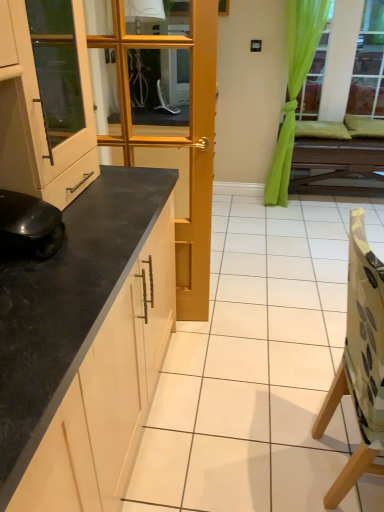
The height and width of the screenshot is (512, 384). Identify the location of wooden table at center. (337, 165).

In order to face black granite countertop at left, should I rotate leftwards or rightwards?

You should look left and rotate roughly 14.981 degrees.

This screenshot has height=512, width=384. What are the coordinates of `black matte robot vacuum cleaner at lower left` in the screenshot? It's located at (29, 225).

What do you see at coordinates (29, 225) in the screenshot? I see `black matte robot vacuum cleaner at lower left` at bounding box center [29, 225].

The width and height of the screenshot is (384, 512). What do you see at coordinates (40, 117) in the screenshot?
I see `matte white cabinet at left` at bounding box center [40, 117].

Locate an element on the screen. green fabric curtain at upper right is located at coordinates (294, 88).

Find the location of a particular element. The image size is (384, 512). wooden table at center is located at coordinates 337,165.

From the image's perspective, which is below, camouflage fabric chair at right or wooden table at center?

camouflage fabric chair at right is shown below in the image.

Considering the positions of points (379, 469) and (319, 178), is point (379, 469) farther from camera compared to point (319, 178)?

No.

Is camouflage fabric chair at right facing towards wooden table at center?

No, camouflage fabric chair at right is not turned towards wooden table at center.

Would you say camouflage fabric chair at right is inside or outside wooden table at center?

camouflage fabric chair at right is spatially situated outside wooden table at center.

How much distance is there between wooden table at center and camouflage fabric chair at right?

A distance of 2.52 meters exists between wooden table at center and camouflage fabric chair at right.

From the image's perspective, which one is positioned lower, wooden table at center or camouflage fabric chair at right?

camouflage fabric chair at right, from the image's perspective.

This screenshot has width=384, height=512. Identify the location of table above the camouflage fabric chair at right (from the image's perspective). (337, 165).

Does wooden table at center lie in front of camouflage fabric chair at right?

No, the depth of wooden table at center is greater than that of camouflage fabric chair at right.

At what (x,y) coordinates should I click in order to perform the action: click on door in front of the green fabric curtain at upper right. Please return your answer as a coordinate pair (x, y). Looking at the image, I should click on (164, 112).

Choose the correct answer: Is wooden door at center inside green fabric curtain at upper right or outside it?

wooden door at center cannot be found inside green fabric curtain at upper right.

Considering the points (175, 8) and (317, 29), which point is in front, point (175, 8) or point (317, 29)?

Point (175, 8)

From a real-world perspective, between black granite countertop at left and camouflage fabric chair at right, who is vertically lower?

black granite countertop at left is physically lower.

Is black granite countertop at left surrounding camouflage fabric chair at right?

No, black granite countertop at left does not contain camouflage fabric chair at right.

Is camouflage fabric chair at right at the back of black granite countertop at left?

No.

From the image's perspective, which is below, black granite countertop at left or camouflage fabric chair at right?

camouflage fabric chair at right is shown below in the image.

Which is in front, point (306, 40) or point (367, 168)?

The point (306, 40) is closer.

From the image's perspective, is green fabric curtain at upper right above wooden table at center?

Yes, from the image's perspective, green fabric curtain at upper right is on top of wooden table at center.

From their relative heights in the image, would you say green fabric curtain at upper right is taller or shorter than wooden table at center?

green fabric curtain at upper right is taller than wooden table at center.

The height and width of the screenshot is (512, 384). Find the location of `curtain above the wooden table at center (from a real-world perspective)`. curtain above the wooden table at center (from a real-world perspective) is located at coordinates (294, 88).

Considering the sizes of objects matte white cabinet at left and black granite countertop at left in the image provided, who is smaller, matte white cabinet at left or black granite countertop at left?

Smaller between the two is matte white cabinet at left.

From the image's perspective, which one is positioned lower, matte white cabinet at left or black granite countertop at left?

black granite countertop at left appears lower in the image.

Is matte white cabinet at left positioned beyond the bounds of black granite countertop at left?

Yes, matte white cabinet at left is located beyond the bounds of black granite countertop at left.

Is matte white cabinet at left far away from black granite countertop at left?

matte white cabinet at left is actually quite close to black granite countertop at left.

Find the location of a particular element. The width and height of the screenshot is (384, 512). countertop in front of the matte white cabinet at left is located at coordinates (66, 303).

From a real-world perspective, is black granite countertop at left positioned above or below matte white cabinet at left?

Clearly, from a real-world perspective, black granite countertop at left is below matte white cabinet at left.

How far apart are black granite countertop at left and matte white cabinet at left?

A distance of 12.91 inches exists between black granite countertop at left and matte white cabinet at left.

Are black granite countertop at left and matte white cabinet at left far apart?

Actually, black granite countertop at left and matte white cabinet at left are a little close together.

At what (x,y) coordinates should I click in order to perform the action: click on table lying behind the camouflage fabric chair at right. Please return your answer as a coordinate pair (x, y). Image resolution: width=384 pixels, height=512 pixels. Looking at the image, I should click on (337, 165).

This screenshot has height=512, width=384. Find the location of `table beneath the camouflage fabric chair at right (from a real-world perspective)`. table beneath the camouflage fabric chair at right (from a real-world perspective) is located at coordinates (337, 165).

Looking at the image, which one is located further to green fabric curtain at upper right, wooden table at center or black granite countertop at left?

The object further to green fabric curtain at upper right is black granite countertop at left.

Which object lies nearer to the anchor point black granite countertop at left, wooden table at center or wooden door at center?

Based on the image, wooden door at center appears to be nearer to black granite countertop at left.

Looking at the image, which one is located closer to wooden table at center, matte white cabinet at left or black matte robot vacuum cleaner at lower left?

matte white cabinet at left is closer to wooden table at center.

Looking at this image, looking at the image, which one is located further to wooden table at center, matte white cabinet at left or camouflage fabric chair at right?

Among the two, camouflage fabric chair at right is located further to wooden table at center.

Which object lies nearer to the anchor point green fabric curtain at upper right, black granite countertop at left or wooden door at center?

Among the two, wooden door at center is located nearer to green fabric curtain at upper right.

Estimate the real-world distances between objects in this image. Which object is further from matte white cabinet at left, black granite countertop at left or green fabric curtain at upper right?

The object further to matte white cabinet at left is green fabric curtain at upper right.

From the image, which object appears to be nearer to green fabric curtain at upper right, wooden door at center or matte white cabinet at left?

wooden door at center.

Looking at the image, which one is located closer to wooden door at center, matte white cabinet at left or green fabric curtain at upper right?

matte white cabinet at left is closer to wooden door at center.

At what (x,y) coordinates should I click in order to perform the action: click on door located between black granite countertop at left and green fabric curtain at upper right in the depth direction. Please return your answer as a coordinate pair (x, y). This screenshot has height=512, width=384. Looking at the image, I should click on (164, 112).

I want to click on door between black matte robot vacuum cleaner at lower left and wooden table at center from front to back, so click(164, 112).

Where is `countertop between camouflage fabric chair at right and green fabric curtain at upper right from front to back`? This screenshot has height=512, width=384. countertop between camouflage fabric chair at right and green fabric curtain at upper right from front to back is located at coordinates (66, 303).

Find the location of a particular element. The height and width of the screenshot is (512, 384). curtain positioned between camouflage fabric chair at right and wooden table at center from near to far is located at coordinates (294, 88).